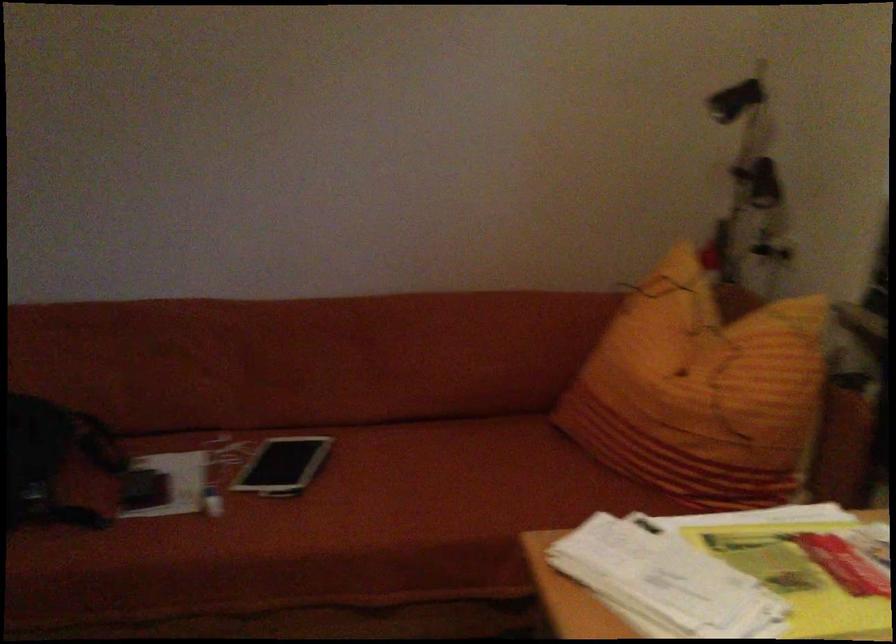
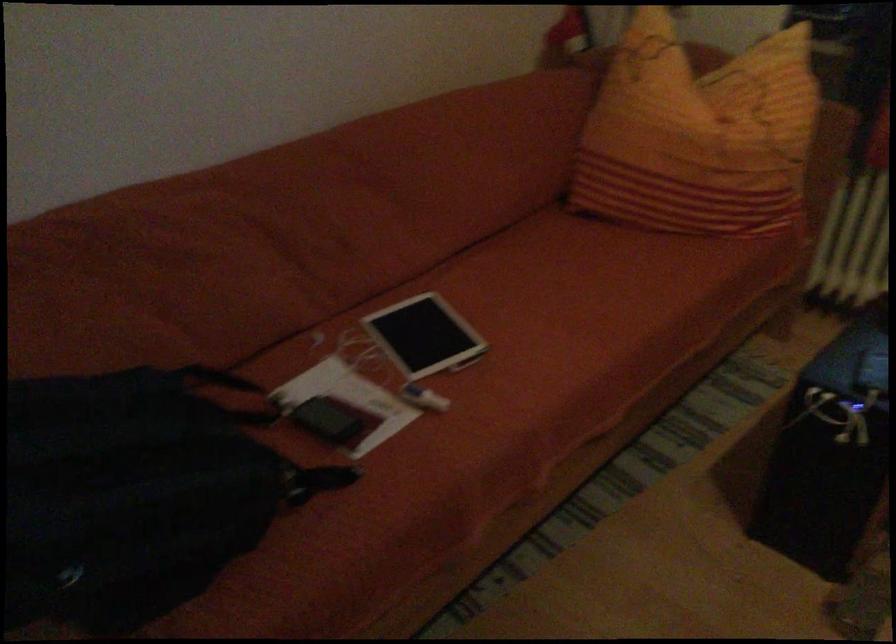
The point at (401,504) is marked in the first image. Where is the corresponding point in the second image?

(574, 323)